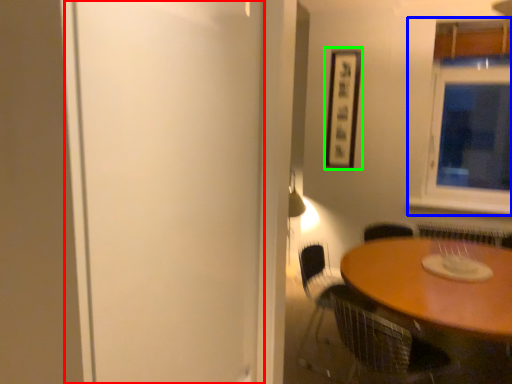
Question: Considering the real-world distances, which object is farthest from screen door (highlighted by a red box)? window (highlighted by a blue box) or picture frame (highlighted by a green box)?

Choices:
 (A) window
 (B) picture frame

Answer: (A)